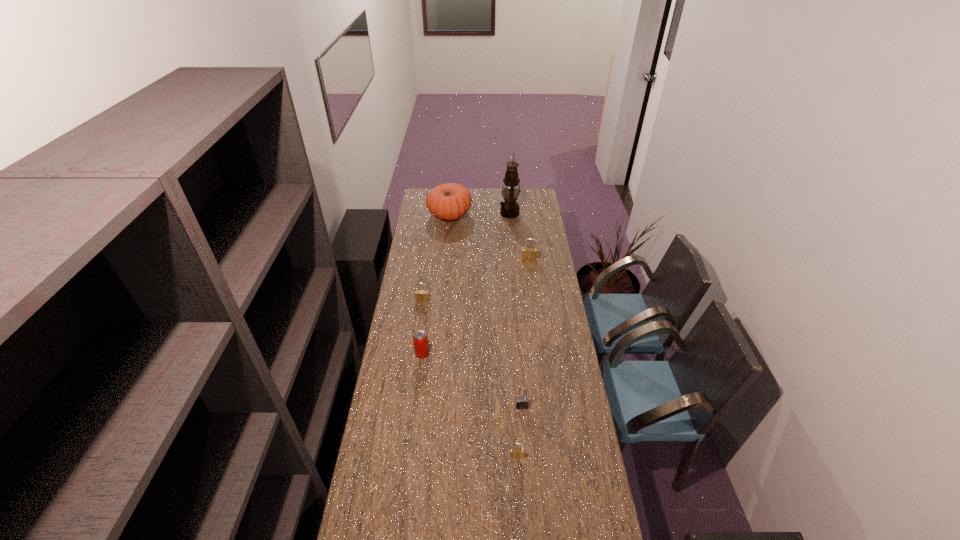
Select which object is the closest to the brown oil lamp. Please provide its 2D coordinates. Your answer should be formatted as a tuple, i.e. [(x, y)], where the tuple contains the x and y coordinates of a point satisfying the conditions above.

[(450, 201)]

The height and width of the screenshot is (540, 960). Identify the location of the fourth closest padlock to the leftmost brass padlock. (514, 537).

What are the coordinates of `padlock that is the nearest to the brown oil lamp` in the screenshot? It's located at (528, 254).

Where is `brass padlock that is the closest to the bigger gray padlock`? This screenshot has width=960, height=540. brass padlock that is the closest to the bigger gray padlock is located at coordinates (514, 452).

Locate an element on the screen. brass padlock that can be found as the second closest to the right gray padlock is located at coordinates (421, 295).

Image resolution: width=960 pixels, height=540 pixels. In order to click on blank space that satisfies the following two spatial constraints: 1. on the back side of the tallest object; 2. on the left side of the pumpkin in this screenshot , I will do `click(450, 213)`.

Where is `vacant region that satisfies the following two spatial constraints: 1. on the back side of the oil lamp; 2. on the right side of the fifth farthest object`? Image resolution: width=960 pixels, height=540 pixels. vacant region that satisfies the following two spatial constraints: 1. on the back side of the oil lamp; 2. on the right side of the fifth farthest object is located at coordinates (440, 213).